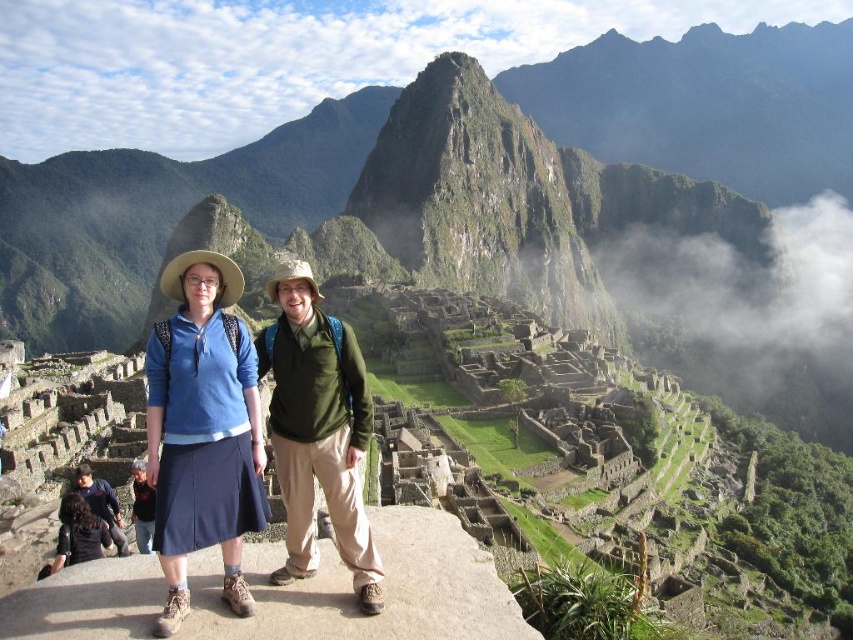
Question: Can you confirm if green grassy mountain at center is positioned below green matte vest at center?

Choices:
 (A) no
 (B) yes

Answer: (A)

Question: Which object is farther from the camera taking this photo?

Choices:
 (A) blue fabric shirt at center
 (B) green matte vest at center
 (C) dark blue jacket at lower left

Answer: (C)

Question: Does green grassy mountain at center appear over green matte vest at center?

Choices:
 (A) no
 (B) yes

Answer: (B)

Question: Does dark brown leather jacket at lower left have a larger size compared to dark blue skirt at center?

Choices:
 (A) yes
 (B) no

Answer: (A)

Question: Which of these objects is positioned closest to the green matte vest at center?

Choices:
 (A) dark blue skirt at center
 (B) green grassy mountain at center

Answer: (A)

Question: Among these points, which one is farthest from the camera?

Choices:
 (A) (361, 545)
 (B) (223, 554)

Answer: (A)